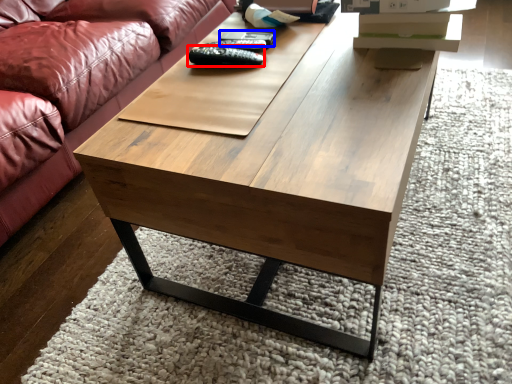
Question: Which object appears closest to the camera in this image, remote (highlighted by a red box) or remote (highlighted by a blue box)?

Choices:
 (A) remote
 (B) remote

Answer: (A)